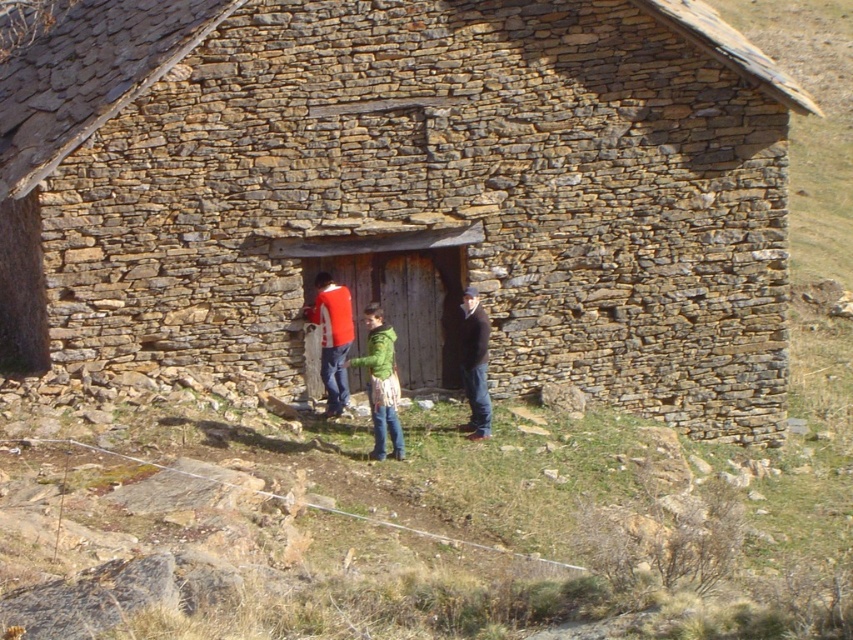
What do you see at coordinates (332, 337) in the screenshot?
I see `red cotton sweater at center` at bounding box center [332, 337].

Who is more distant from viewer, (x=323, y=275) or (x=490, y=419)?

Point (x=323, y=275)

Locate an element on the screen. red cotton sweater at center is located at coordinates coord(332,337).

In the scene shown: Which is more to the left, rustic stone hut at center or green matte jacket at center?

From the viewer's perspective, rustic stone hut at center appears more on the left side.

Image resolution: width=853 pixels, height=640 pixels. What do you see at coordinates (407, 188) in the screenshot?
I see `rustic stone hut at center` at bounding box center [407, 188].

Who is more forward, (131, 296) or (386, 328)?

Point (386, 328) is more forward.

Find the location of `rustic stone hut at center`. rustic stone hut at center is located at coordinates (407, 188).

Who is more forward, (x=367, y=349) or (x=480, y=371)?

Positioned in front is point (x=480, y=371).

Is green wool sweater at center below dark brown leather jacket at center?

No, green wool sweater at center is not below dark brown leather jacket at center.

Which is in front, point (343, 300) or point (476, 339)?

Positioned in front is point (476, 339).

Identify the location of green wool sweater at center. (360, 358).